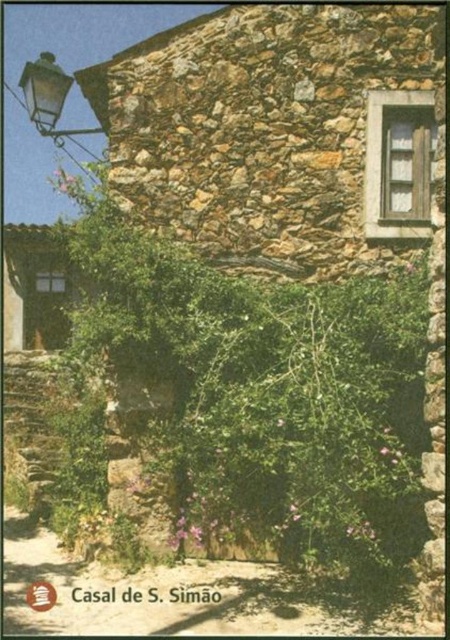
What is the 2D coordinate of the green leafy ivy at center?

The green leafy ivy at center is located at the 2D coordinate point of [256,387].